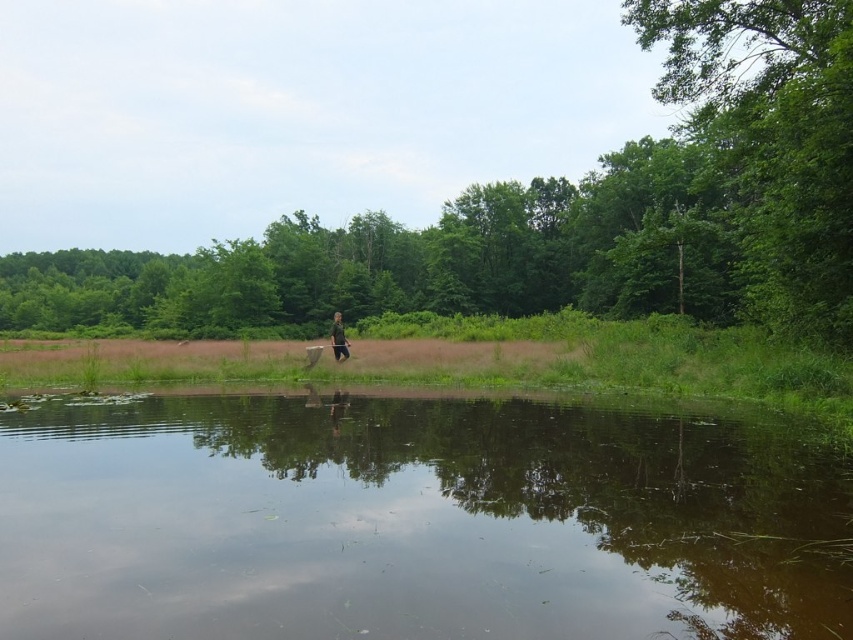
You are standing on the grassy area and want to reach the green leafy tree at center. Which direction should you move relative to the brown reflective water at center?

You should move to the right of the brown reflective water at center to reach the green leafy tree at center since the brown reflective water at center is to the left of the green leafy tree at center.

You are planning to cross the brown reflective water at center to reach the green fabric person at center. The water is 39.66 feet away from the person. If you can swim 50 feet in one minute, how long will it take you to reach them?

The distance between the brown reflective water at center and the green fabric person at center is 39.66 feet. Since you can swim 50 feet per minute, it would take approximately 0.8 minutes or about 48 seconds to reach them.